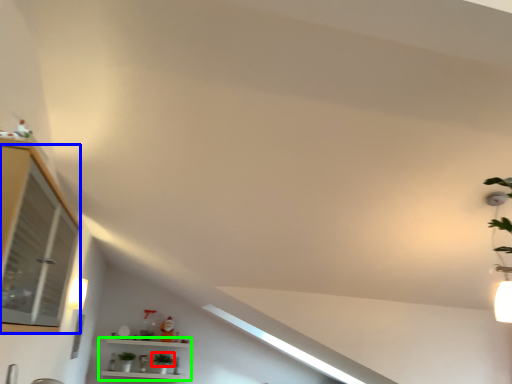
Question: Which object is positioned closest to plant (highlighted by a red box)? Select from window (highlighted by a blue box) and shelf (highlighted by a green box).

Choices:
 (A) window
 (B) shelf

Answer: (B)